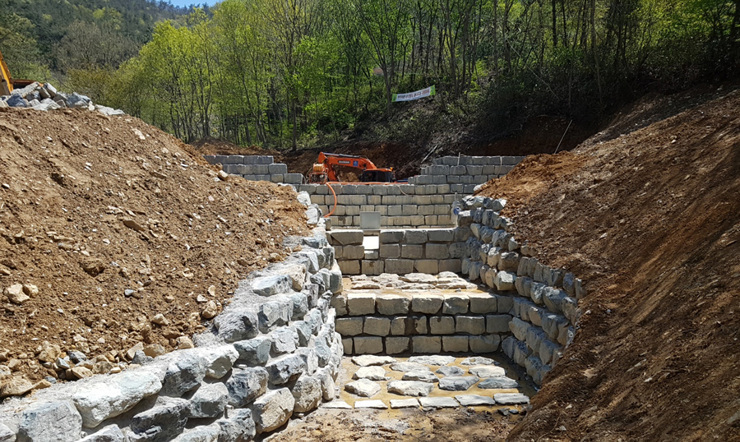
You are a GUI agent. You are given a task and a screenshot of the screen. Output one action in this format:
    pyautogui.click(x=<x>, y=<y>)
    Task: Click on the cord
    
    Given the screenshot: What is the action you would take?
    pyautogui.click(x=336, y=197)